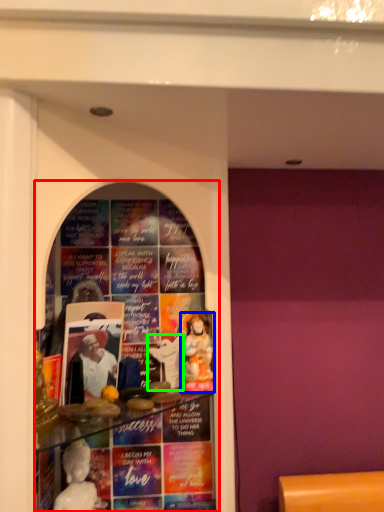
Question: Which object is the farthest from shop window (highlighted by a red box)? Choose among these: person (highlighted by a blue box) or toy (highlighted by a green box).

Choices:
 (A) person
 (B) toy

Answer: (B)